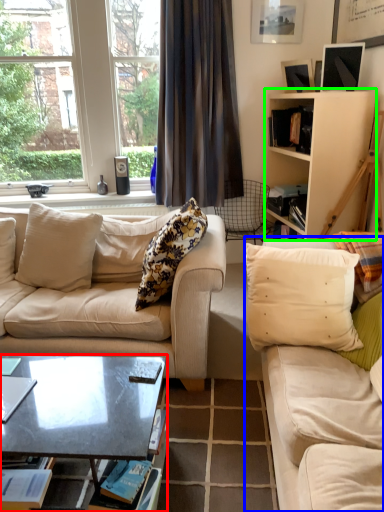
Question: Which object is the farthest from coffee table (highlighted by a red box)? Choose among these: studio couch (highlighted by a blue box) or cabinetry (highlighted by a green box).

Choices:
 (A) studio couch
 (B) cabinetry

Answer: (B)